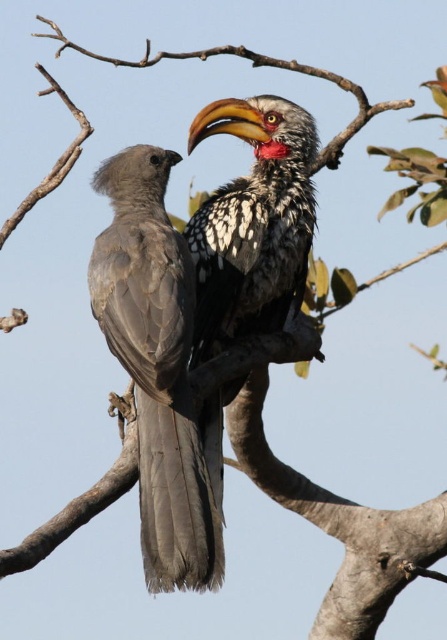
Question: Observing the image, what is the correct spatial positioning of gray matte bird at center in reference to speckled feathered hornbill at center?

Choices:
 (A) right
 (B) left

Answer: (B)

Question: Which point is closer to the camera?

Choices:
 (A) (168, 561)
 (B) (287, 216)

Answer: (A)

Question: Can you confirm if gray matte bird at center is positioned to the left of speckled feathered hornbill at center?

Choices:
 (A) no
 (B) yes

Answer: (B)

Question: Which of the following is the farthest from the observer?

Choices:
 (A) speckled feathered hornbill at center
 (B) gray matte bird at center

Answer: (A)

Question: Is gray matte bird at center further to the viewer compared to speckled feathered hornbill at center?

Choices:
 (A) no
 (B) yes

Answer: (A)

Question: Which object is farther from the camera taking this photo?

Choices:
 (A) gray matte bird at center
 (B) speckled feathered hornbill at center

Answer: (B)